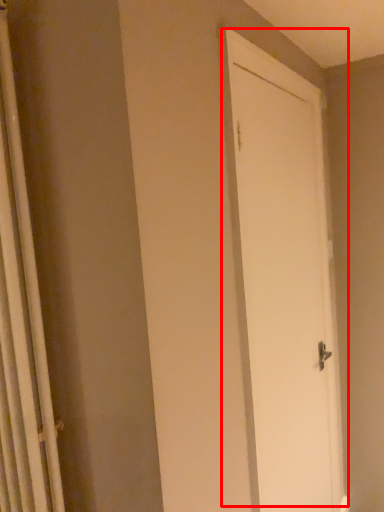
Question: Observing the image, what is the correct spatial positioning of door (annotated by the red box) in reference to shower curtain?

Choices:
 (A) right
 (B) left

Answer: (A)